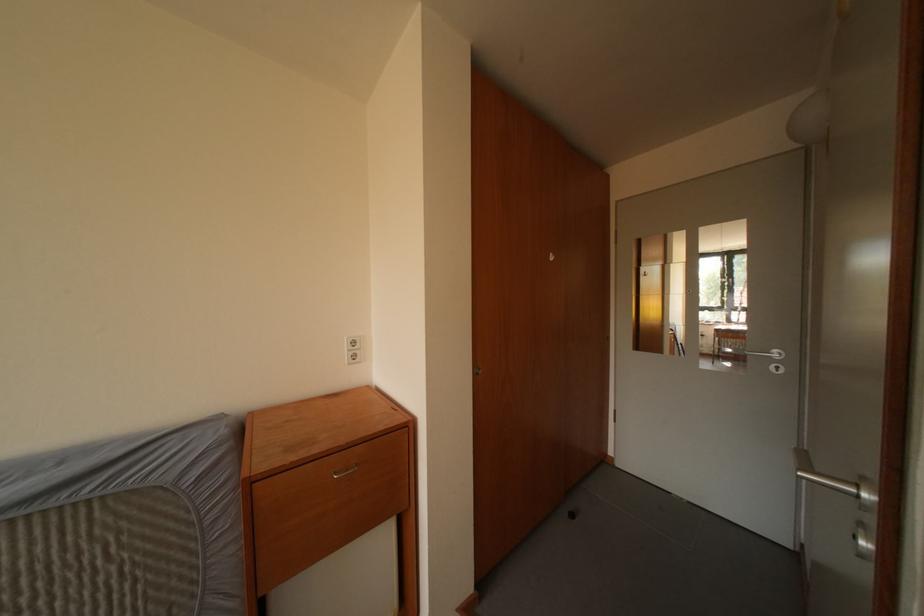
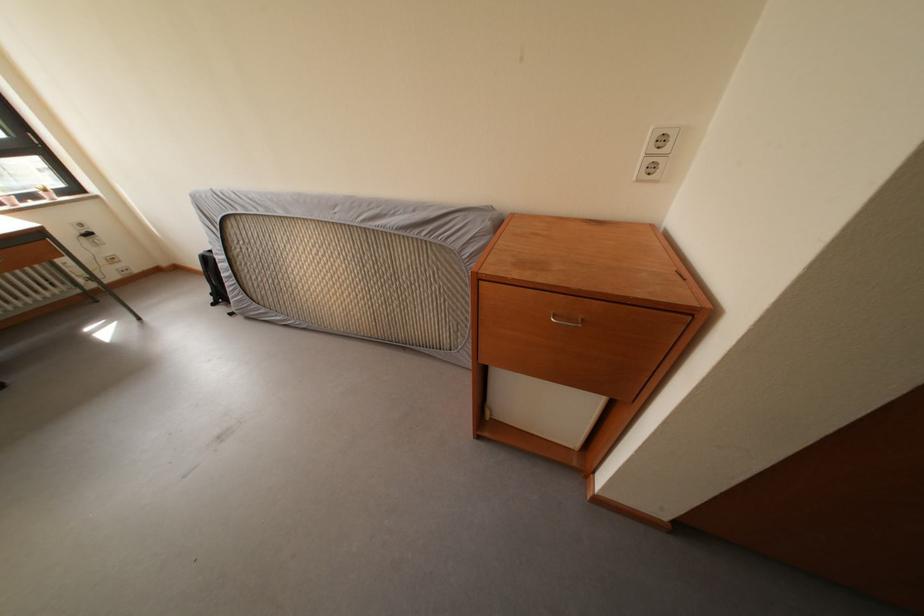
In the second image, find the point that corresponds to the point at 358,357 in the first image.

(657, 161)